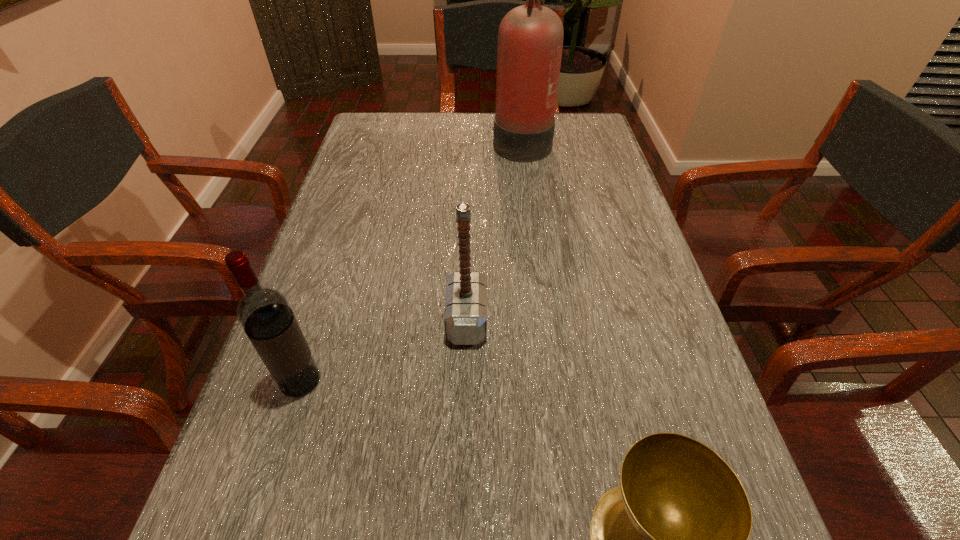
Find the location of a particular element. vacant space located 0.300m on the striking surface of the third object from right to left is located at coordinates click(641, 320).

This screenshot has width=960, height=540. What are the coordinates of `object positioned at the far edge` in the screenshot? It's located at (530, 40).

Identify the location of object at the left edge. (264, 313).

What are the coordinates of `object present at the right edge` in the screenshot? It's located at (530, 40).

The image size is (960, 540). I want to click on object positioned at the far right corner, so click(x=530, y=40).

Locate an element on the screen. The image size is (960, 540). free spot at the far edge of the desktop is located at coordinates (417, 122).

Image resolution: width=960 pixels, height=540 pixels. I want to click on free space at the left edge of the desktop, so click(356, 230).

Identify the location of free space at the right edge of the desktop. (620, 204).

At what (x,y) coordinates should I click in order to perform the action: click on free region at the far left corner of the desktop. Please return your answer as a coordinate pair (x, y). The image size is (960, 540). Looking at the image, I should click on (410, 122).

Identify the location of vacant area at the far right corner of the desktop. The image size is (960, 540). (562, 118).